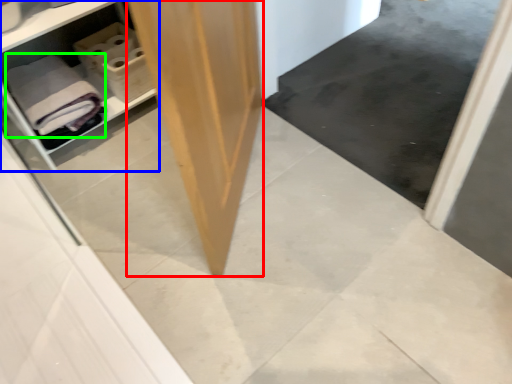
Question: Which is farther away from plywood (highlighted by a red box)? shelf (highlighted by a blue box) or bath towel (highlighted by a green box)?

Choices:
 (A) shelf
 (B) bath towel

Answer: (A)